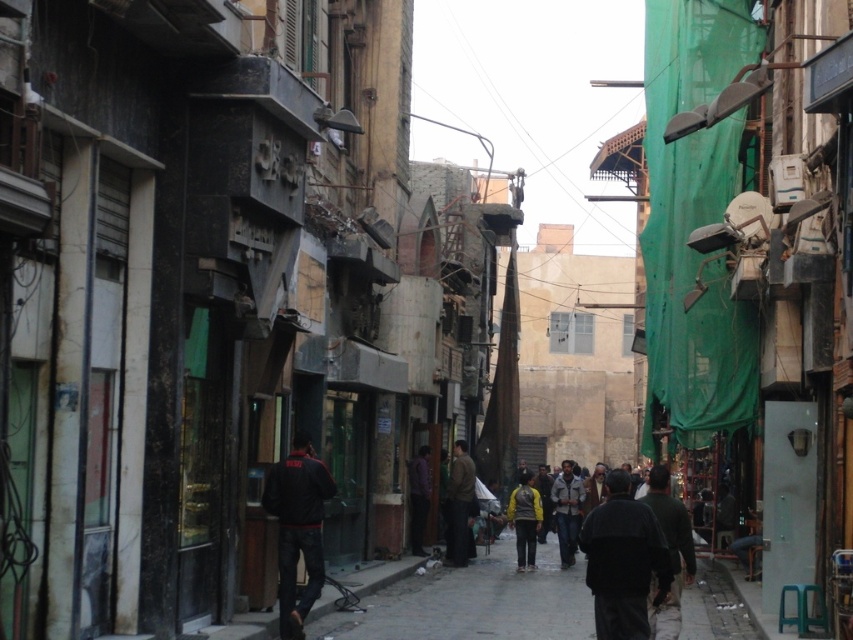
You are a pedestrian walking down the street and see both the dark brown leather jacket at center and the purple matte shirt at center. Which one is positioned more to the right side?

The dark brown leather jacket at center is positioned to the right of the purple matte shirt at center, so the dark brown leather jacket at center is more to the right side.

You are a delivery person trying to navigate through the narrow urban street scene. You see a dark gray sweater at center and a dark green fabric at center. Which object is easier to step over?

The dark gray sweater at center is smaller than the dark green fabric at center, so it is easier to step over the dark gray sweater at center.